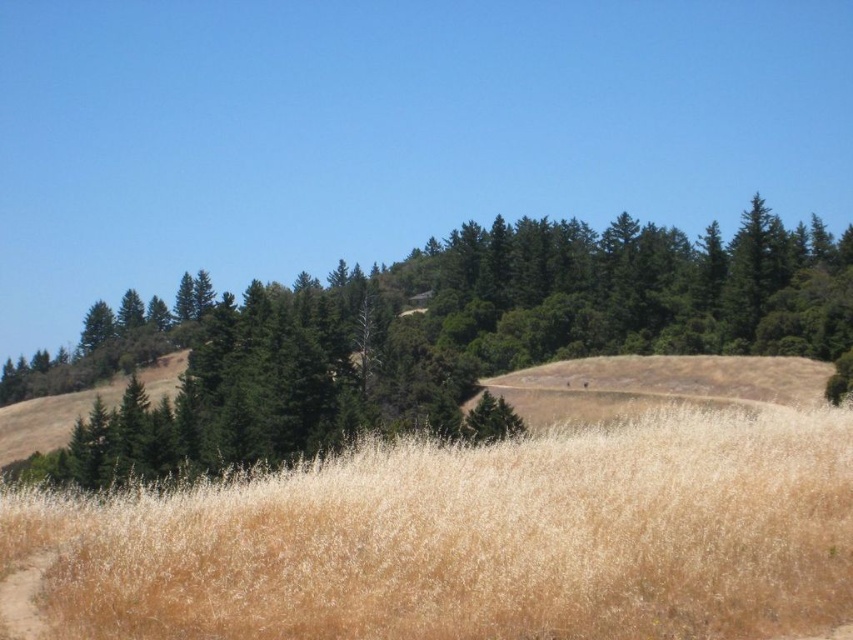
Question: Can you confirm if dry grass at center is positioned to the left of green matte tree at center?

Choices:
 (A) yes
 (B) no

Answer: (B)

Question: Among these points, which one is farthest from the camera?

Choices:
 (A) (538, 448)
 (B) (57, 364)

Answer: (B)

Question: Can you confirm if dry grass at center is positioned to the right of green matte tree at center?

Choices:
 (A) yes
 (B) no

Answer: (A)

Question: Which of the following is the closest to the observer?

Choices:
 (A) (514, 250)
 (B) (726, 580)

Answer: (B)

Question: Does dry grass at center appear on the left side of green matte tree at center?

Choices:
 (A) no
 (B) yes

Answer: (A)